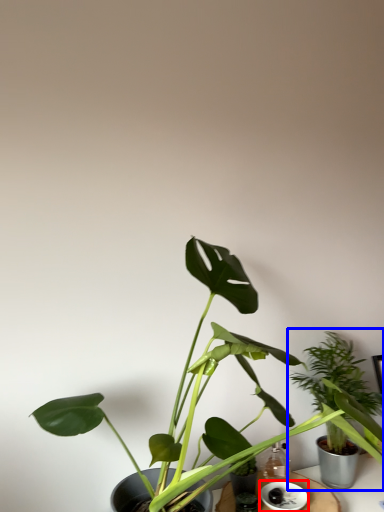
Question: Which point is closer to the camera, saucer (highlighted by a red box) or houseplant (highlighted by a blue box)?

Choices:
 (A) saucer
 (B) houseplant

Answer: (A)